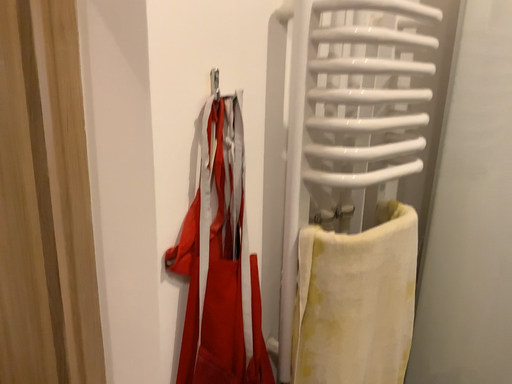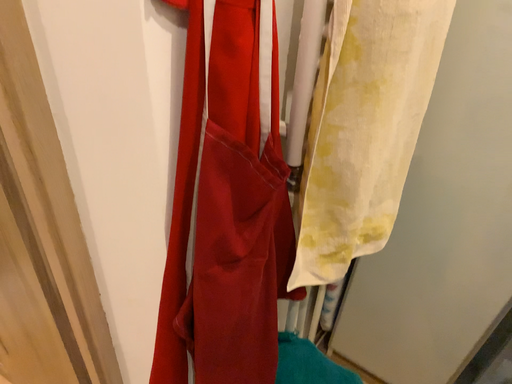
Question: Which way did the camera rotate in the video?

Choices:
 (A) rotated upward
 (B) rotated downward

Answer: (B)